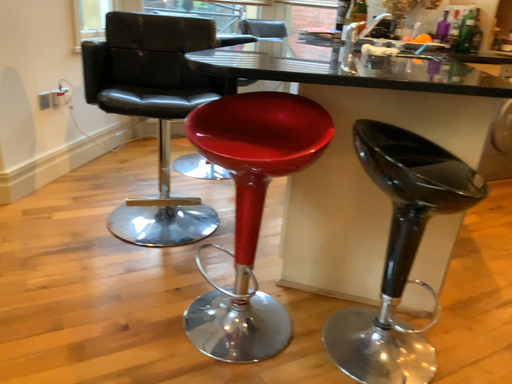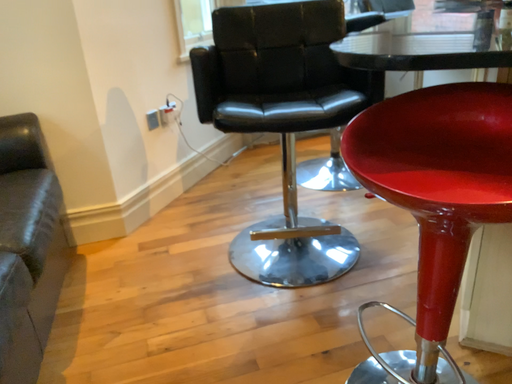
Question: How did the camera likely rotate when shooting the video?

Choices:
 (A) rotated right
 (B) rotated left

Answer: (B)